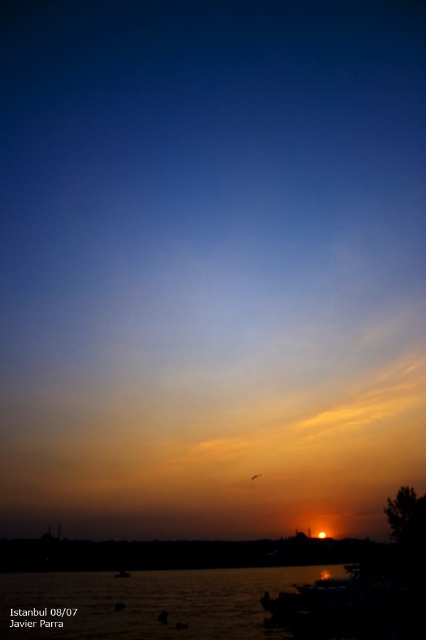
You are a photographer trying to capture the sunset reflection on the silvery reflective water at lower center. To ensure the reflection is centered in your photo, where should you aim your camera? Use the 2D coordinates provided to explain your answer.

The silvery reflective water at lower center is located at point (147, 604), so you should aim your camera at that coordinate to center the reflection in your photo.